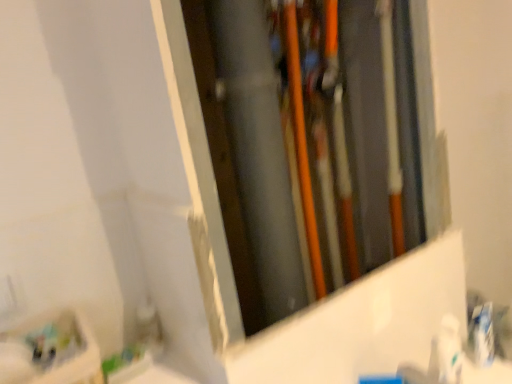
Question: Is white glossy toothpaste at right thinner than white glossy toothpaste at lower right?

Choices:
 (A) no
 (B) yes

Answer: (B)

Question: Is there a large distance between white glossy toothpaste at right and white glossy toothpaste at lower right?

Choices:
 (A) no
 (B) yes

Answer: (A)

Question: From the image's perspective, would you say white glossy toothpaste at right is shown under white glossy toothpaste at lower right?

Choices:
 (A) yes
 (B) no

Answer: (B)

Question: Considering the relative sizes of white glossy toothpaste at right and white glossy toothpaste at lower right in the image provided, is white glossy toothpaste at right bigger than white glossy toothpaste at lower right?

Choices:
 (A) yes
 (B) no

Answer: (B)

Question: Can white glossy toothpaste at lower right be found inside white glossy toothpaste at right?

Choices:
 (A) no
 (B) yes

Answer: (A)

Question: Is white glossy toothpaste at right closer to the viewer compared to white glossy toothpaste at lower right?

Choices:
 (A) no
 (B) yes

Answer: (A)

Question: From the image's perspective, is white glossy toothpaste at lower right located beneath white glossy toothpaste at right?

Choices:
 (A) yes
 (B) no

Answer: (A)

Question: From the image's perspective, is white glossy toothpaste at lower right located above white glossy toothpaste at right?

Choices:
 (A) yes
 (B) no

Answer: (B)

Question: Can you confirm if white glossy toothpaste at lower right is positioned to the left of white glossy toothpaste at right?

Choices:
 (A) no
 (B) yes

Answer: (B)

Question: Is white glossy toothpaste at lower right bigger than white glossy toothpaste at right?

Choices:
 (A) no
 (B) yes

Answer: (B)

Question: Is white glossy toothpaste at lower right surrounding white glossy toothpaste at right?

Choices:
 (A) yes
 (B) no

Answer: (B)

Question: From a real-world perspective, is white glossy toothpaste at lower right located beneath white glossy toothpaste at right?

Choices:
 (A) no
 (B) yes

Answer: (A)

Question: Considering the positions of white glossy toothpaste at right and white glossy toothpaste at lower right in the image, is white glossy toothpaste at right wider or thinner than white glossy toothpaste at lower right?

Choices:
 (A) wide
 (B) thin

Answer: (B)